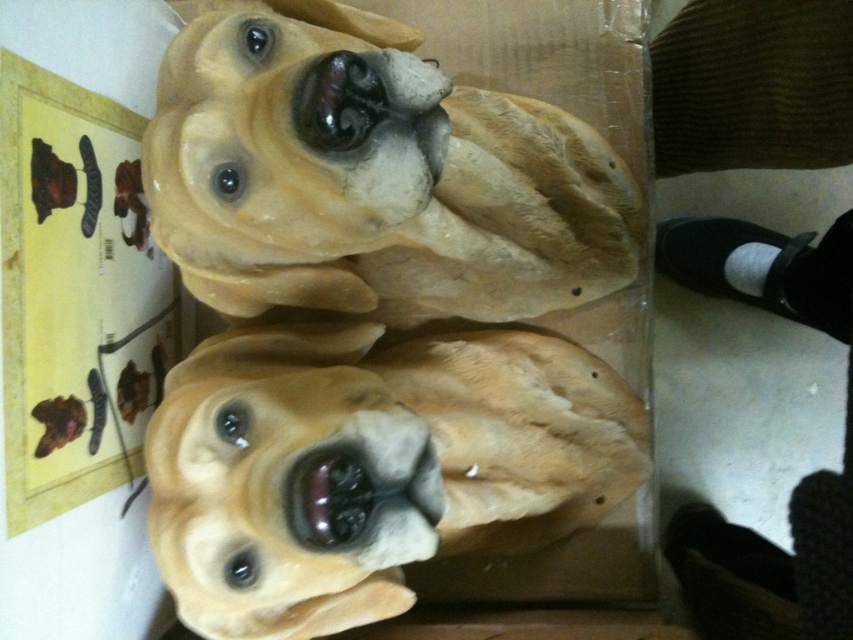
Can you confirm if matte clay dog heads at center is taller than matte brown dog at center?

Yes.

Between point (271, 140) and point (256, 460), which one is positioned behind?

The point (256, 460) is more distant.

Who is more forward, (x=357, y=24) or (x=624, y=480)?

Point (x=357, y=24)

I want to click on matte clay dog heads at center, so click(393, 308).